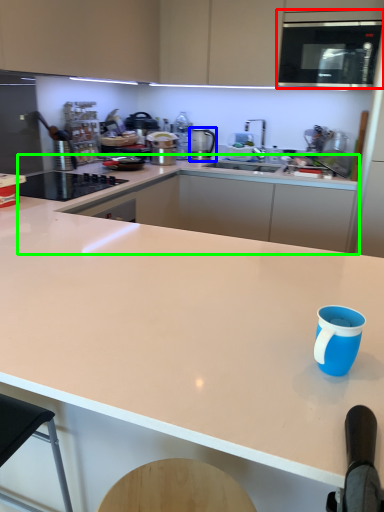
Question: Estimate the real-world distances between objects in this image. Which object is farther from microwave oven (highlighted by a red box), kitchen appliance (highlighted by a blue box) or countertop (highlighted by a green box)?

Choices:
 (A) kitchen appliance
 (B) countertop

Answer: (A)